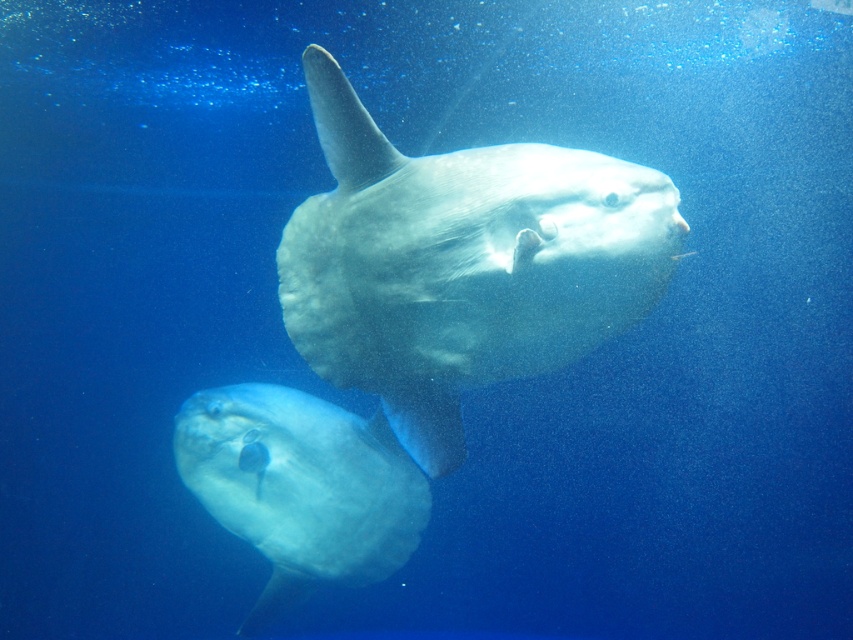
Who is positioned more to the right, translucent white fish at center or translucent rubber fish at center?

Positioned to the right is translucent white fish at center.

Does translucent white fish at center have a lesser height compared to translucent rubber fish at center?

Incorrect, translucent white fish at center's height does not fall short of translucent rubber fish at center's.

Does point (300, 252) come closer to viewer compared to point (183, 449)?

That is True.

Locate an element on the screen. translucent white fish at center is located at coordinates (462, 264).